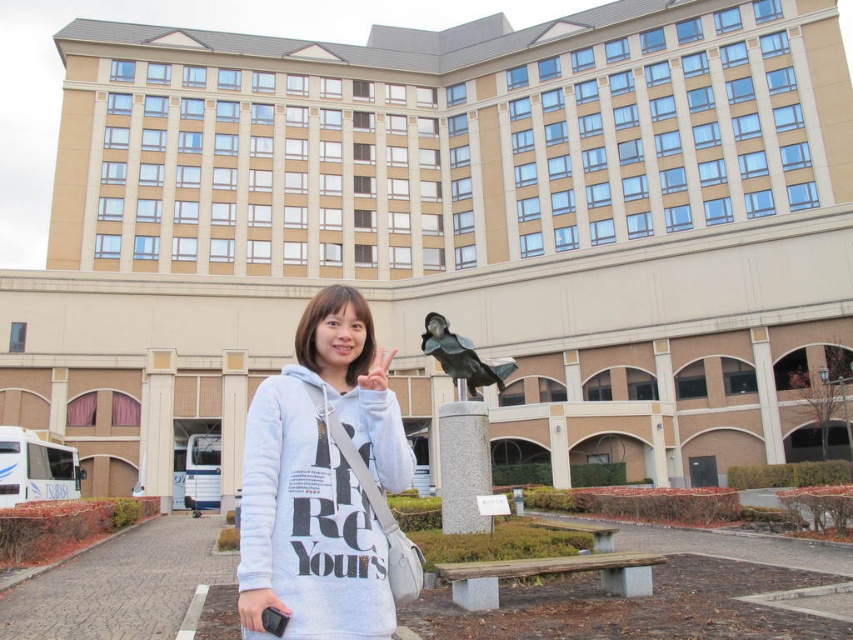
Question: Is white cotton hoodie at center thinner than shiny black bird at center?

Choices:
 (A) no
 (B) yes

Answer: (B)

Question: Which object is farther from the camera taking this photo?

Choices:
 (A) shiny black bird at center
 (B) white cotton hoodie at center

Answer: (A)

Question: Which point is closer to the camera?

Choices:
 (A) (456, 339)
 (B) (294, 483)

Answer: (B)

Question: Which point is farther to the camera?

Choices:
 (A) shiny black bird at center
 (B) white cotton hoodie at center

Answer: (A)

Question: Is white cotton hoodie at center below shiny black bird at center?

Choices:
 (A) yes
 (B) no

Answer: (A)

Question: Does white cotton hoodie at center appear under shiny black bird at center?

Choices:
 (A) yes
 (B) no

Answer: (A)